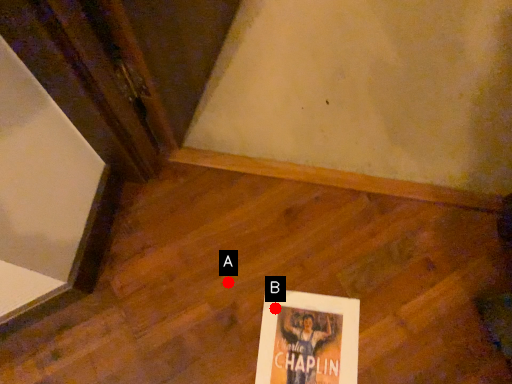
Question: Two points are circled on the image, labeled by A and B beside each circle. Which point is closer to the camera?

Choices:
 (A) A is closer
 (B) B is closer

Answer: (B)